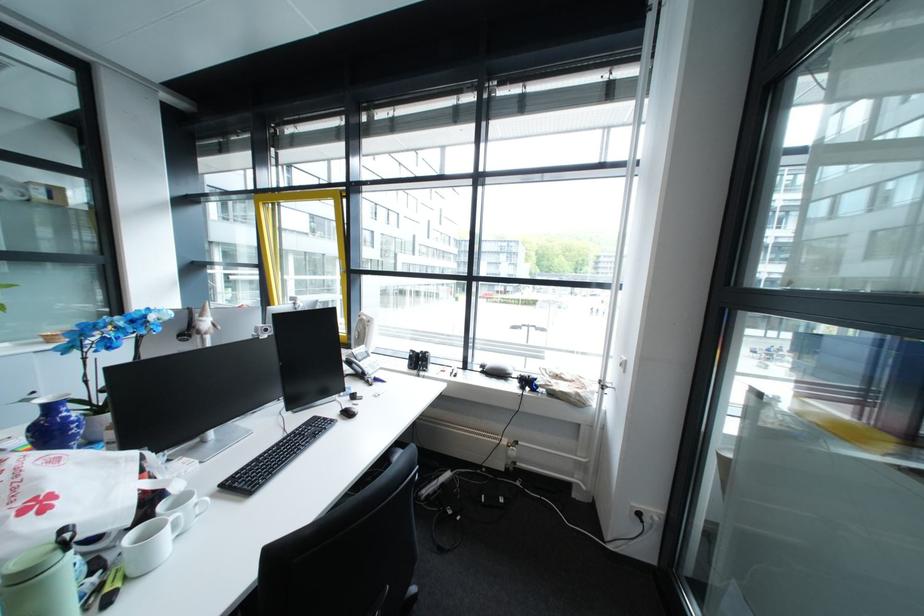
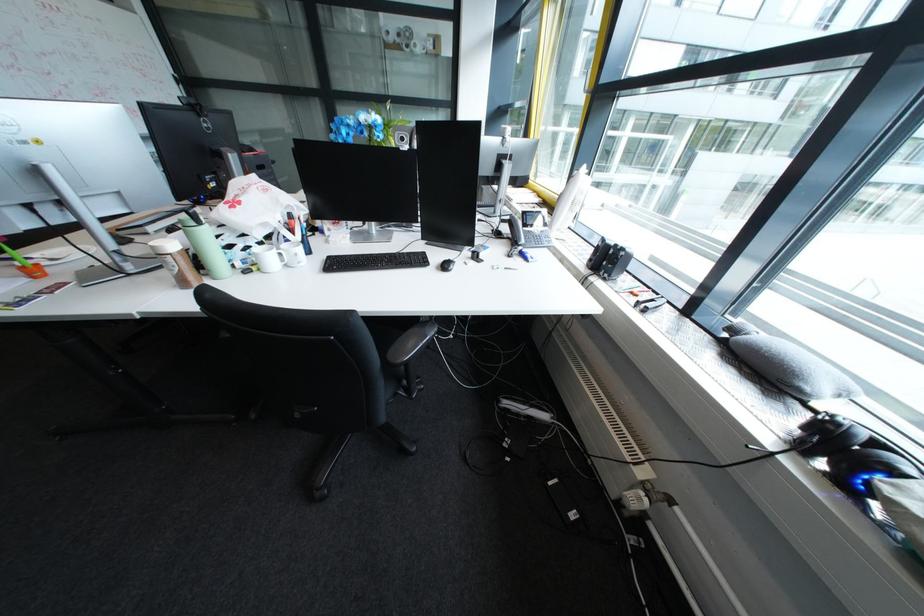
Find the pixel in the second image that matches point 515,444 in the first image.

(646, 467)